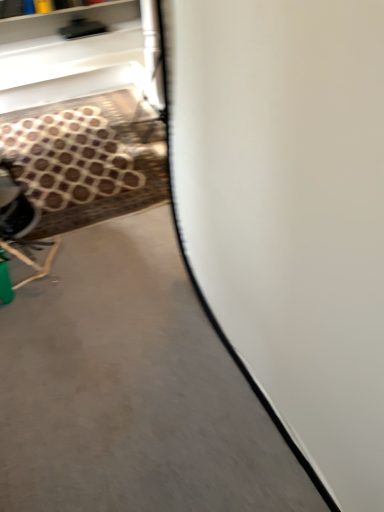
Question: Considering the positions of gray concrete at center and brown patterned carpet at lower left in the image, is gray concrete at center bigger or smaller than brown patterned carpet at lower left?

Choices:
 (A) big
 (B) small

Answer: (A)

Question: From their relative heights in the image, would you say gray concrete at center is taller or shorter than brown patterned carpet at lower left?

Choices:
 (A) short
 (B) tall

Answer: (B)

Question: In terms of width, does gray concrete at center look wider or thinner when compared to brown patterned carpet at lower left?

Choices:
 (A) wide
 (B) thin

Answer: (A)

Question: From the image's perspective, is brown patterned carpet at lower left positioned above or below gray concrete at center?

Choices:
 (A) below
 (B) above

Answer: (B)

Question: Choose the correct answer: Is brown patterned carpet at lower left inside gray concrete at center or outside it?

Choices:
 (A) inside
 (B) outside

Answer: (A)

Question: Considering the positions of brown patterned carpet at lower left and gray concrete at center in the image, is brown patterned carpet at lower left taller or shorter than gray concrete at center?

Choices:
 (A) tall
 (B) short

Answer: (B)

Question: Looking at the image, does brown patterned carpet at lower left seem bigger or smaller compared to gray concrete at center?

Choices:
 (A) big
 (B) small

Answer: (B)